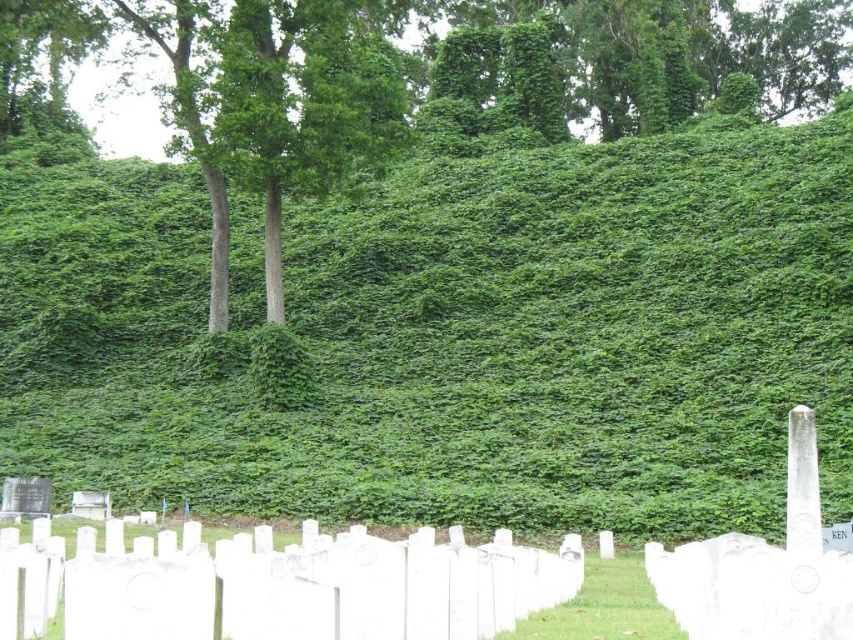
You are a hiker navigating through the cemetery. You notice the green leafy hillside at center and the green leafy tree at upper center. Which of these two landmarks is positioned higher up in the scene?

The green leafy tree at upper center is positioned higher up in the scene than the green leafy hillside at center.

You are a gardener assessing the cemetery layout. You notice the green leafy hillside at center and the green leafy tree at upper center. Which of these two has a wider spread in terms of horizontal coverage?

The green leafy tree at upper center has a wider spread in terms of horizontal coverage than the green leafy hillside at center.

Based on the photo, based on the coordinates provided, which object is situated at point (457,337) in the image?

The green leafy hillside at center is located at point (457,337).